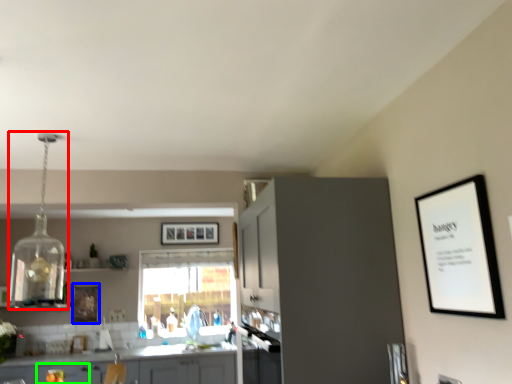
Question: Based on their relative distances, which object is nearer to light fixture (highlighted by a red box)? Choose from picture frame (highlighted by a blue box) and drawer (highlighted by a green box).

Choices:
 (A) picture frame
 (B) drawer

Answer: (A)